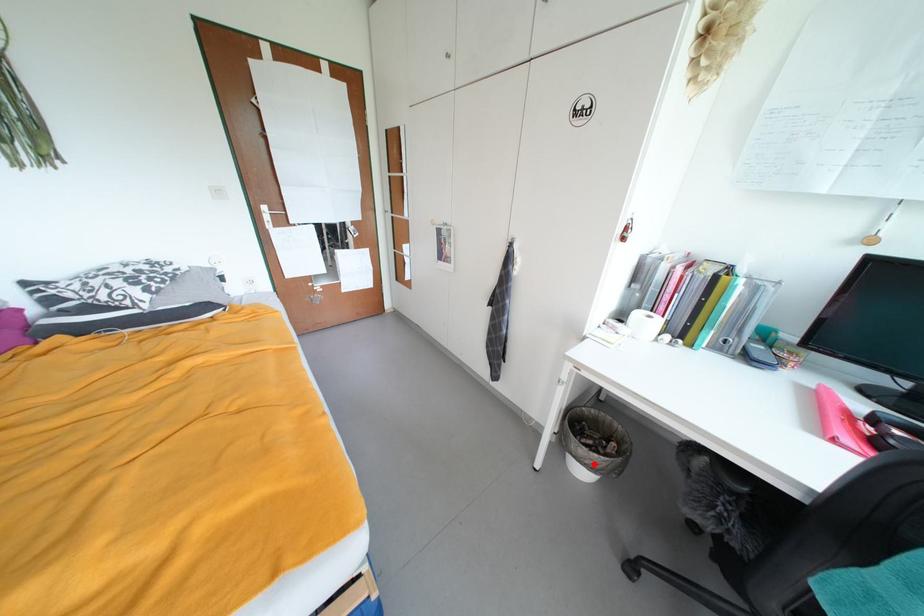
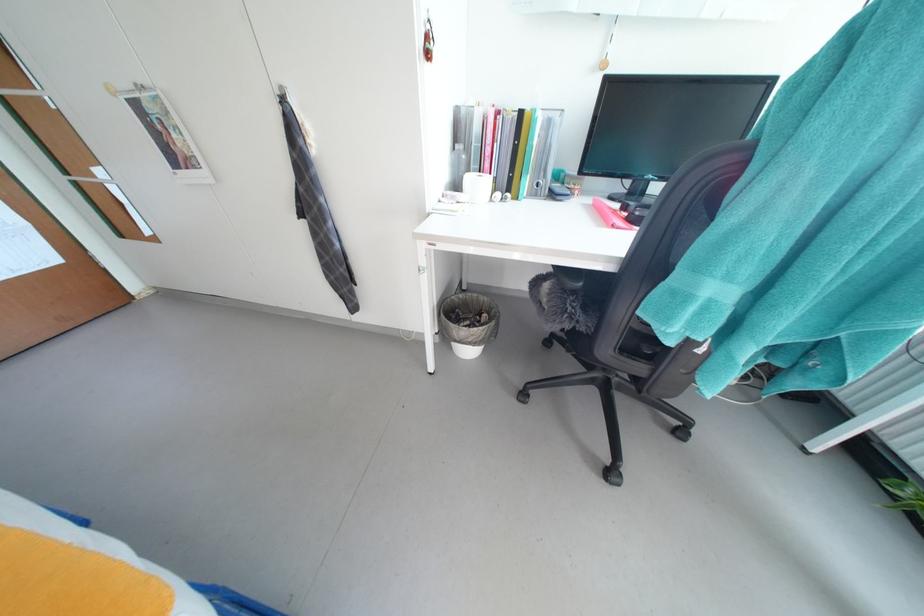
In the second image, find the point that corresponds to the highlighted location in the first image.

(478, 342)